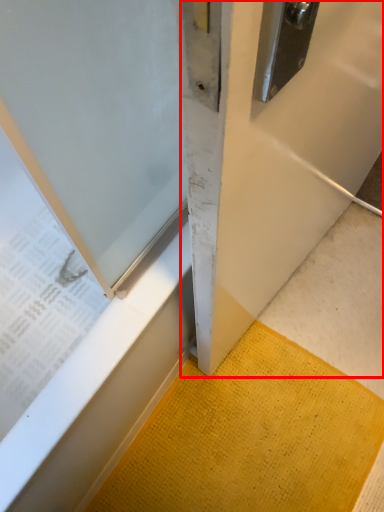
Question: From the image's perspective, where is door (annotated by the red box) located relative to doormat?

Choices:
 (A) above
 (B) below

Answer: (A)